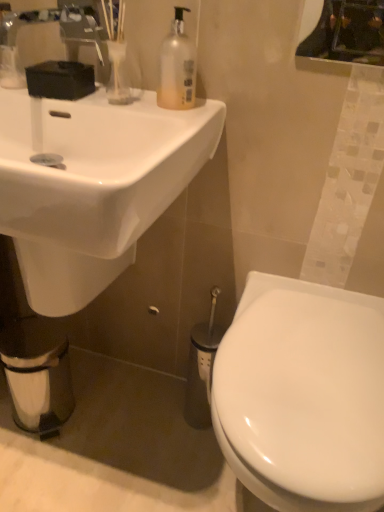
Question: Does white glossy sink at upper left lie behind metallic reflective mirror at upper right?

Choices:
 (A) no
 (B) yes

Answer: (A)

Question: Is white glossy sink at upper left smaller than metallic reflective mirror at upper right?

Choices:
 (A) yes
 (B) no

Answer: (B)

Question: Is white glossy sink at upper left aimed at metallic reflective mirror at upper right?

Choices:
 (A) no
 (B) yes

Answer: (A)

Question: Are white glossy sink at upper left and metallic reflective mirror at upper right located far from each other?

Choices:
 (A) yes
 (B) no

Answer: (B)

Question: Is white glossy sink at upper left positioned beyond the bounds of metallic reflective mirror at upper right?

Choices:
 (A) no
 (B) yes

Answer: (B)

Question: Is white glossy sink at upper left inside the boundaries of white matte toilet paper at lower left, or outside?

Choices:
 (A) inside
 (B) outside

Answer: (B)

Question: Looking at their shapes, would you say white glossy sink at upper left is wider or thinner than white matte toilet paper at lower left?

Choices:
 (A) wide
 (B) thin

Answer: (A)

Question: Based on their sizes in the image, would you say white glossy sink at upper left is bigger or smaller than white matte toilet paper at lower left?

Choices:
 (A) big
 (B) small

Answer: (A)

Question: Visually, is white glossy sink at upper left positioned to the left or to the right of white matte toilet paper at lower left?

Choices:
 (A) right
 (B) left

Answer: (A)

Question: From the image's perspective, is white glossy sink at upper left above or below white glossy toilet at lower right?

Choices:
 (A) below
 (B) above

Answer: (B)

Question: Would you say white glossy sink at upper left is inside or outside white glossy toilet at lower right?

Choices:
 (A) outside
 (B) inside

Answer: (A)

Question: In terms of width, does white glossy sink at upper left look wider or thinner when compared to white glossy toilet at lower right?

Choices:
 (A) thin
 (B) wide

Answer: (A)

Question: From a real-world perspective, relative to white glossy toilet at lower right, is white glossy sink at upper left vertically above or below?

Choices:
 (A) below
 (B) above

Answer: (B)

Question: Is white matte toilet paper at lower left in front of or behind translucent plastic soap dispenser at upper center in the image?

Choices:
 (A) front
 (B) behind

Answer: (B)

Question: In terms of height, does white matte toilet paper at lower left look taller or shorter compared to translucent plastic soap dispenser at upper center?

Choices:
 (A) short
 (B) tall

Answer: (B)